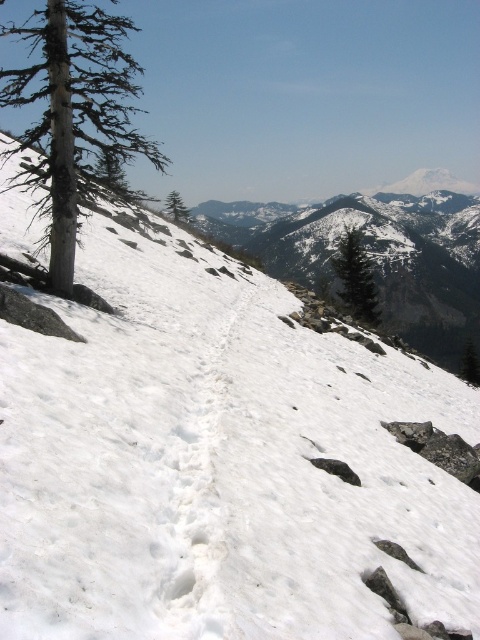
In the scene shown: Does smooth gray bark tree at left have a smaller size compared to green matte tree at upper center?

No, smooth gray bark tree at left is not smaller than green matte tree at upper center.

Does smooth gray bark tree at left have a larger size compared to green matte tree at upper center?

Correct, smooth gray bark tree at left is larger in size than green matte tree at upper center.

Is point (86, 51) farther from viewer compared to point (349, 248)?

No, it is not.

This screenshot has height=640, width=480. In order to click on smooth gray bark tree at left in this screenshot , I will do `click(73, 115)`.

How far apart are green matte tree at upper center and green matte tree at center?

green matte tree at upper center and green matte tree at center are 94.96 meters apart.

Between green matte tree at upper center and green matte tree at center, which one has more height?

green matte tree at center

Does point (377, 320) come closer to viewer compared to point (189, 216)?

Yes, point (377, 320) is closer to viewer.

At what (x,y) coordinates should I click in order to perform the action: click on green matte tree at upper center. Please return your answer as a coordinate pair (x, y). Looking at the image, I should click on (356, 276).

Does smooth gray bark tree at left have a lesser width compared to green matte tree at center?

No.

Is smooth gray bark tree at left to the right of green matte tree at center from the viewer's perspective?

No, smooth gray bark tree at left is not to the right of green matte tree at center.

Locate an element on the screen. The width and height of the screenshot is (480, 640). smooth gray bark tree at left is located at coordinates (73, 115).

The image size is (480, 640). I want to click on smooth gray bark tree at left, so click(x=73, y=115).